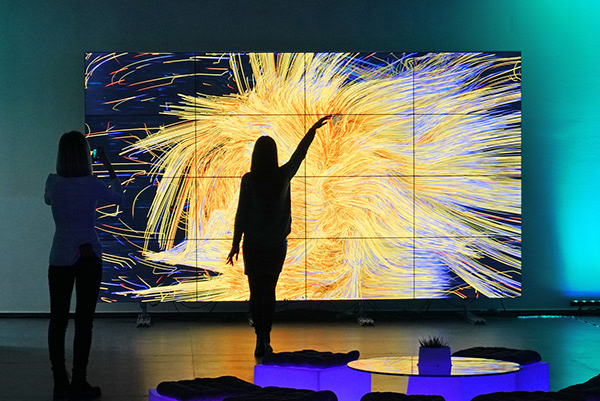
I want to click on round table, so click(x=410, y=367).